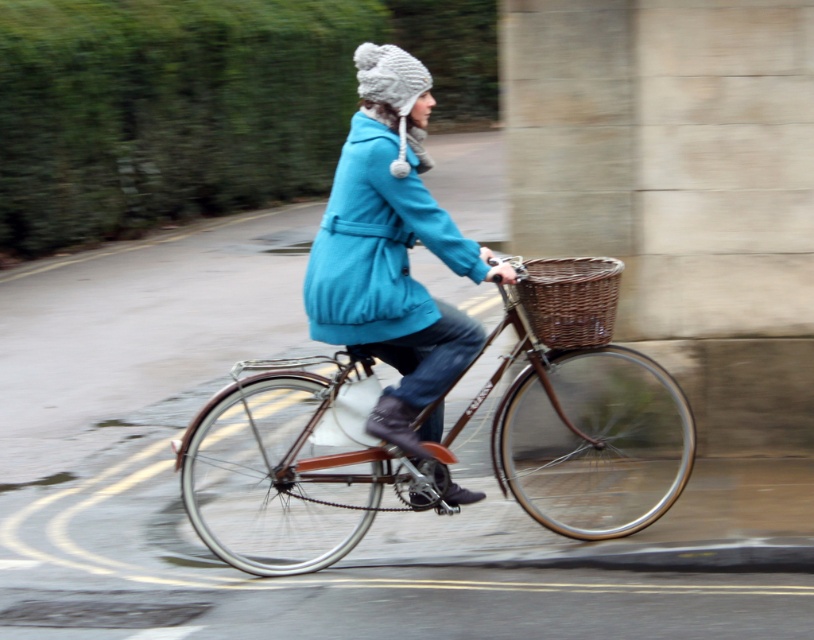
Question: Does turquoise wool coat at center have a greater width compared to matte blue coat at center?

Choices:
 (A) yes
 (B) no

Answer: (A)

Question: Which object is closer to the camera taking this photo?

Choices:
 (A) woven brown basket at center
 (B) matte blue coat at center
 (C) brown wicker basket at center

Answer: (C)

Question: Which of the following is the farthest from the observer?

Choices:
 (A) 567,324
 (B) 344,323
 (C) 408,304

Answer: (A)

Question: Which point is closer to the camera?

Choices:
 (A) (615, 268)
 (B) (387, 317)
 (C) (337, 364)

Answer: (B)

Question: Is matte blue coat at center thinner than woven brown basket at center?

Choices:
 (A) no
 (B) yes

Answer: (A)

Question: Can you confirm if brown wicker basket at center is wider than woven brown basket at center?

Choices:
 (A) yes
 (B) no

Answer: (A)